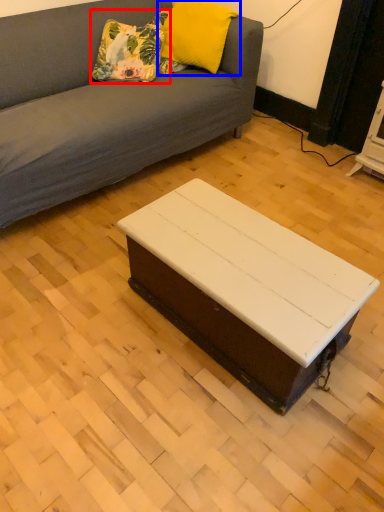
Question: Which object is further to the camera taking this photo, pillow (highlighted by a red box) or pillow (highlighted by a blue box)?

Choices:
 (A) pillow
 (B) pillow

Answer: (A)